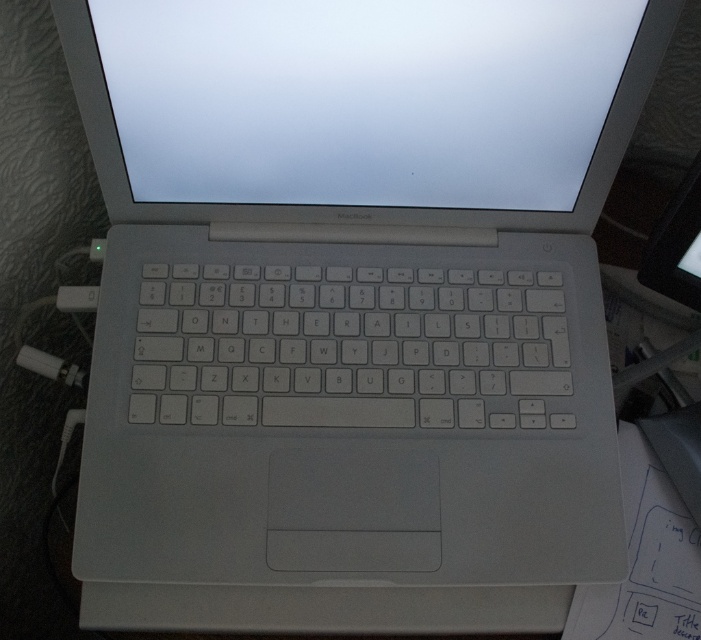
Question: Which object is closer to the camera taking this photo?

Choices:
 (A) white plastic plug at lower left
 (B) white plastic keyboard at center

Answer: (B)

Question: Does white plastic keyboard at center have a smaller size compared to white plastic plug at lower left?

Choices:
 (A) yes
 (B) no

Answer: (B)

Question: Is white plastic keyboard at center bigger than white plastic plug at lower left?

Choices:
 (A) yes
 (B) no

Answer: (A)

Question: Does white plastic keyboard at center come behind white plastic plug at lower left?

Choices:
 (A) yes
 (B) no

Answer: (B)

Question: Which object appears closest to the camera in this image?

Choices:
 (A) white plastic plug at lower left
 (B) white plastic keyboard at center

Answer: (B)